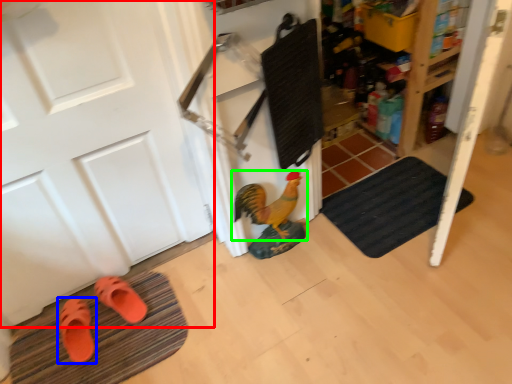
Question: Which is farther away from door (highlighted by a red box)? footwear (highlighted by a blue box) or chicken (highlighted by a green box)?

Choices:
 (A) footwear
 (B) chicken

Answer: (B)